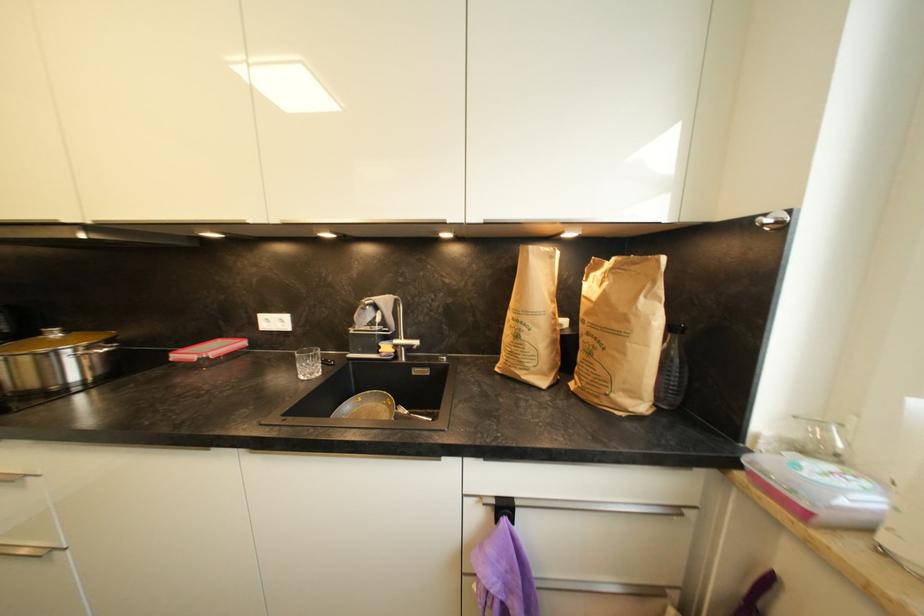
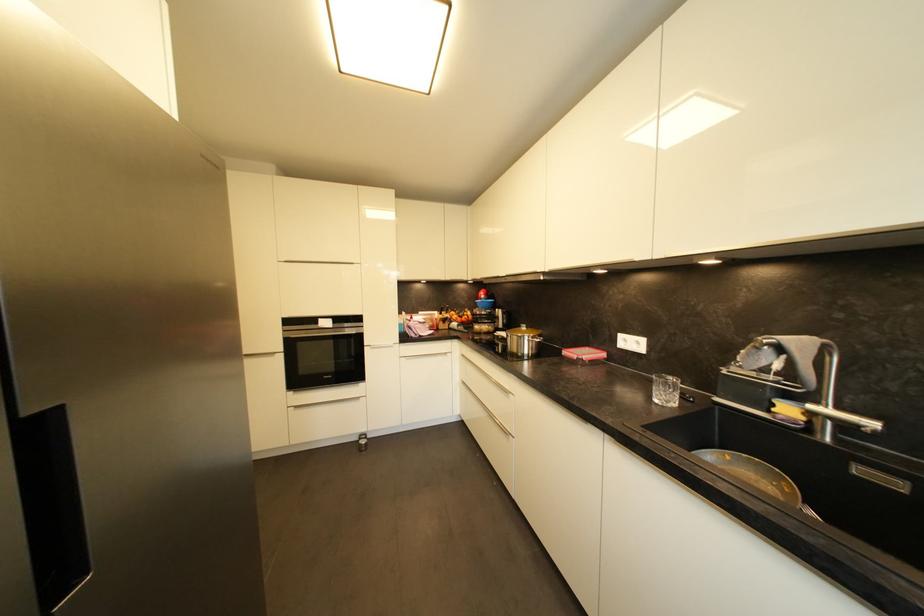
Find the pixel in the second image that matches point 432,373 in the first image.

(904, 487)